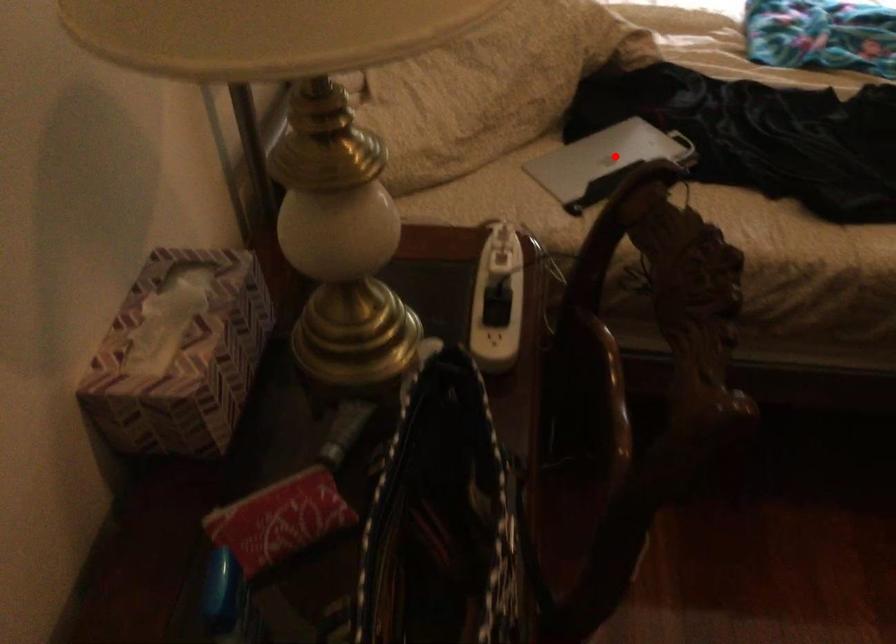
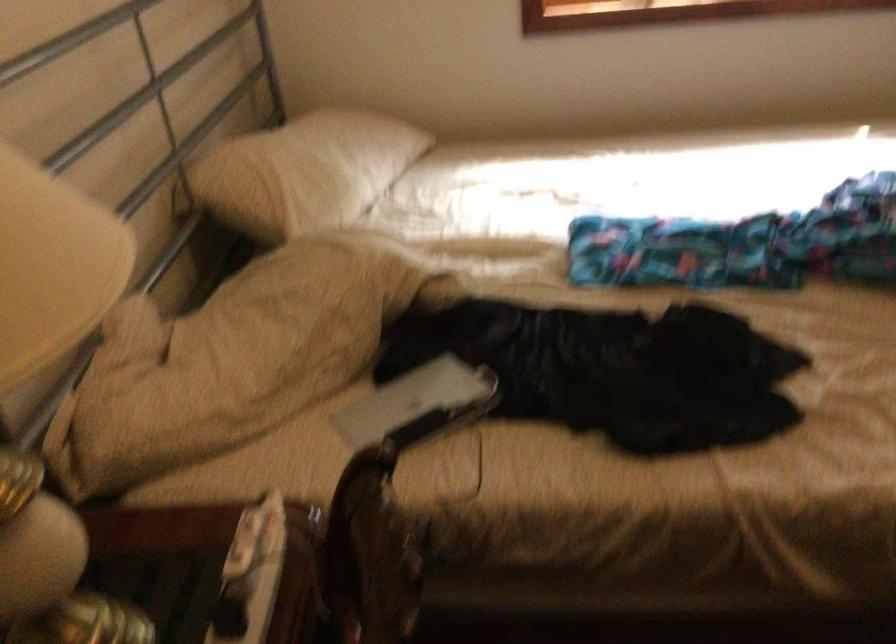
The point at the highlighted location is marked in the first image. Where is the corresponding point in the second image?

(418, 404)